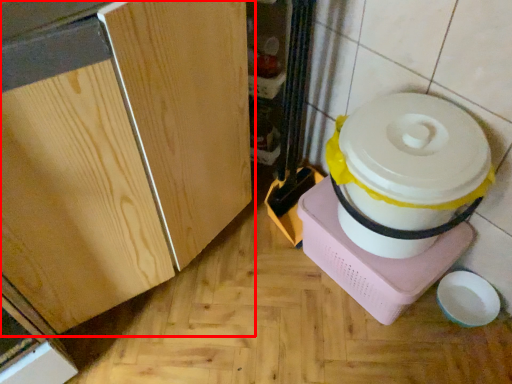
Question: Observing the image, what is the correct spatial positioning of cabinetry (annotated by the red box) in reference to appliance?

Choices:
 (A) left
 (B) right

Answer: (A)